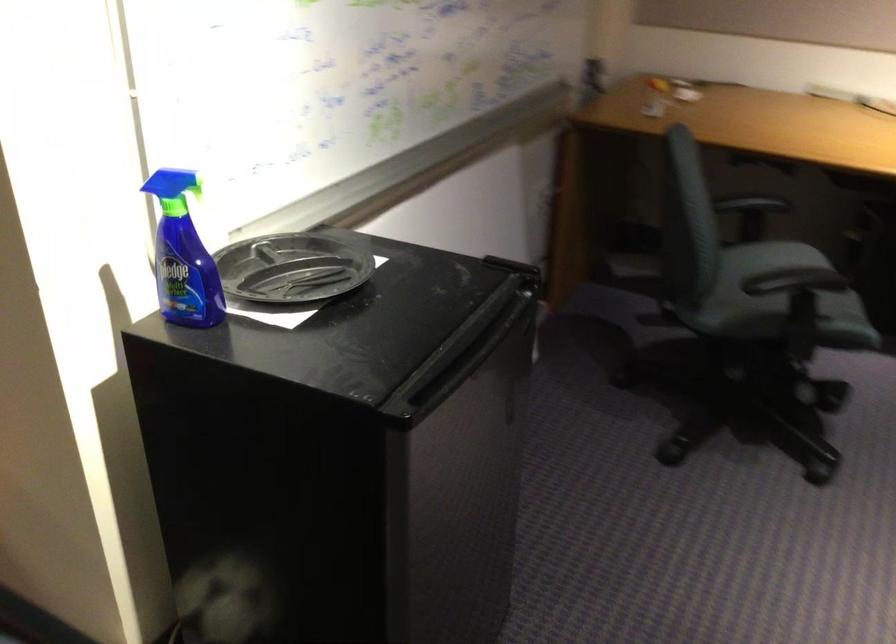
Locate an element on the screen. blue bottle trigger is located at coordinates (168, 182).